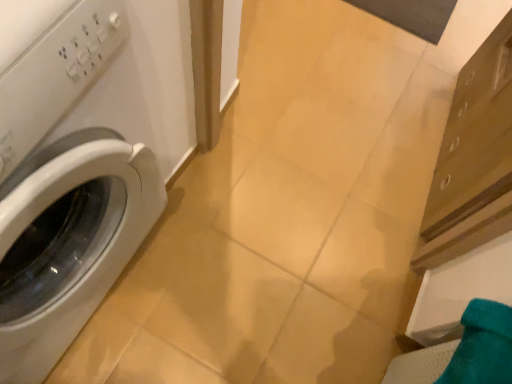
Question: Does point (45, 114) appear closer or farther from the camera than point (484, 339)?

Choices:
 (A) closer
 (B) farther

Answer: (A)

Question: From their relative heights in the image, would you say white glossy washing machine at left is taller or shorter than teal fabric towel at lower right?

Choices:
 (A) tall
 (B) short

Answer: (A)

Question: Do you think white glossy washing machine at left is within teal fabric towel at lower right, or outside of it?

Choices:
 (A) outside
 (B) inside

Answer: (A)

Question: In the image, is teal fabric towel at lower right on the left side or the right side of white glossy washing machine at left?

Choices:
 (A) left
 (B) right

Answer: (B)

Question: From a real-world perspective, is teal fabric towel at lower right positioned above or below white glossy washing machine at left?

Choices:
 (A) below
 (B) above

Answer: (A)

Question: Is teal fabric towel at lower right wider or thinner than white glossy washing machine at left?

Choices:
 (A) wide
 (B) thin

Answer: (B)

Question: Is teal fabric towel at lower right inside the boundaries of white glossy washing machine at left, or outside?

Choices:
 (A) inside
 (B) outside

Answer: (B)